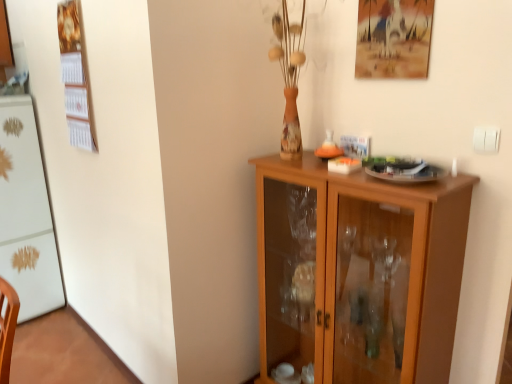
Question: Is wooden cabinet at center wider or thinner than white glossy refrigerator at left?

Choices:
 (A) wide
 (B) thin

Answer: (B)

Question: Considering their positions, is wooden cabinet at center located in front of or behind white glossy refrigerator at left?

Choices:
 (A) behind
 (B) front

Answer: (B)

Question: Based on their relative distances, which object is nearer to the white glossy refrigerator at left?

Choices:
 (A) matte wooden picture frame at upper right
 (B) wooden cabinet at center

Answer: (B)

Question: Considering the real-world distances, which object is farthest from the matte wooden picture frame at upper right?

Choices:
 (A) wooden cabinet at center
 (B) white glossy refrigerator at left

Answer: (B)